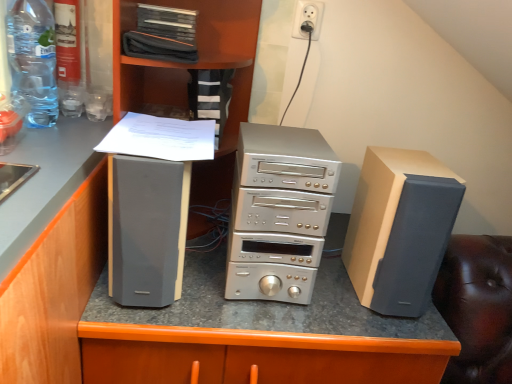
Where is `free space to the right of matte gray speaker at left`? free space to the right of matte gray speaker at left is located at coordinates (211, 294).